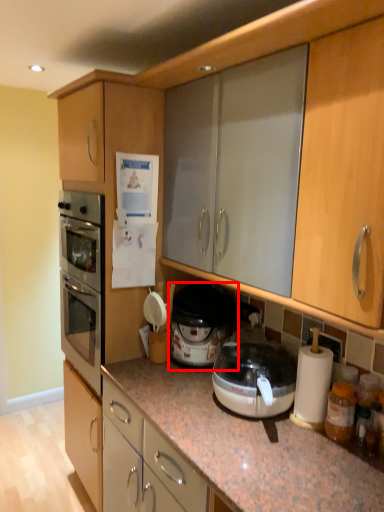
Question: From the image's perspective, where is cooker (annotated by the red box) located in relation to cabinetry in the image?

Choices:
 (A) above
 (B) below

Answer: (B)